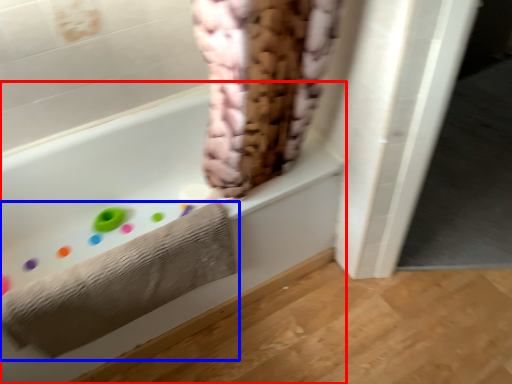
Question: Which point is further to the camera, bathtub (highlighted by a red box) or towel (highlighted by a blue box)?

Choices:
 (A) bathtub
 (B) towel

Answer: (B)